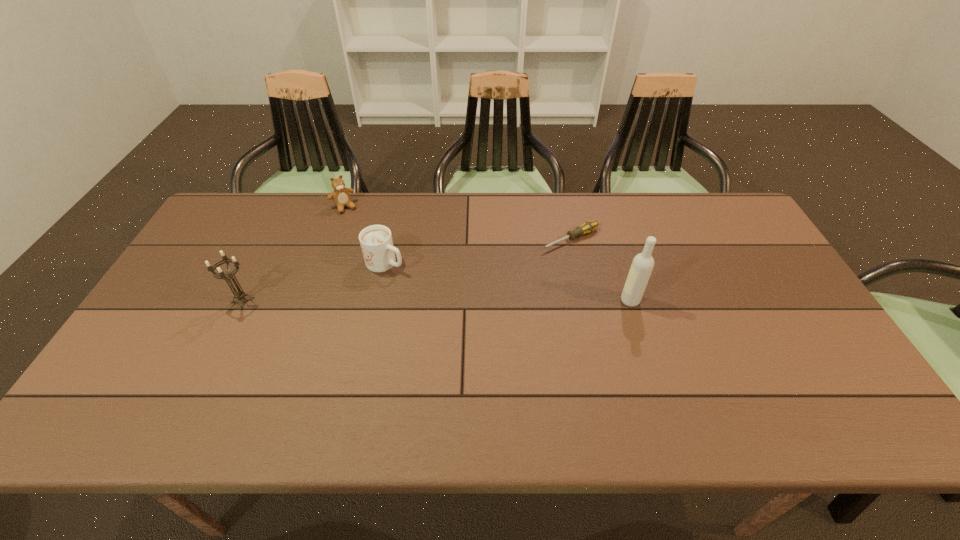
At what (x,y) coordinates should I click in order to perform the action: click on vacant space that is in between the candle holder and the cappuccino. Please return your answer as a coordinate pair (x, y). This screenshot has height=540, width=960. Looking at the image, I should click on (314, 281).

This screenshot has height=540, width=960. Find the location of `free area in between the screwdriver and the rightmost object`. free area in between the screwdriver and the rightmost object is located at coordinates (600, 270).

You are a GUI agent. You are given a task and a screenshot of the screen. Output one action in this format:
    pyautogui.click(x=<x>, y=<y>)
    Task: Click on the unoccupied position between the fourth object from right to left and the tallest object
    The image size is (960, 540).
    Given the screenshot: What is the action you would take?
    pyautogui.click(x=487, y=254)

This screenshot has width=960, height=540. I want to click on free spot between the vodka and the second object from left to right, so click(x=487, y=254).

In order to click on unoccupied area between the tallest object and the leftmost object in this screenshot , I will do `click(437, 300)`.

Locate an element on the screen. The width and height of the screenshot is (960, 540). blank region between the fourth object from left to right and the tallest object is located at coordinates (600, 270).

Locate an element on the screen. The width and height of the screenshot is (960, 540). vacant area that lies between the third object from left to right and the fourth shortest object is located at coordinates (314, 281).

Identify which object is located as the third nearest to the cappuccino. Please provide its 2D coordinates. Your answer should be formatted as a tuple, i.e. [(x, y)], where the tuple contains the x and y coordinates of a point satisfying the conditions above.

[(587, 227)]

Locate which object ranks fourth in proximity to the rightmost object. Please provide its 2D coordinates. Your answer should be formatted as a tuple, i.e. [(x, y)], where the tuple contains the x and y coordinates of a point satisfying the conditions above.

[(240, 294)]

Where is `vacant space that satisfies the following two spatial constraints: 1. on the front side of the vodka; 2. on the right side of the third object from right to left`? The width and height of the screenshot is (960, 540). vacant space that satisfies the following two spatial constraints: 1. on the front side of the vodka; 2. on the right side of the third object from right to left is located at coordinates (377, 300).